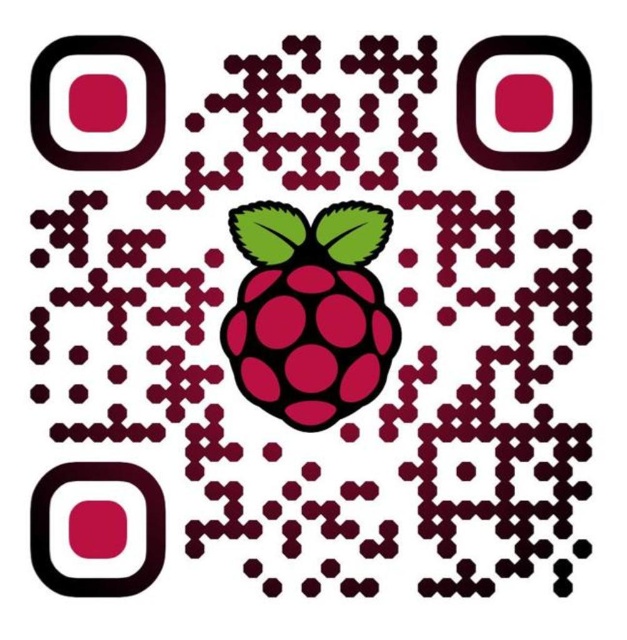
Question: Can you confirm if matte black square at bottom left is positioned below matte black square at upper right?

Choices:
 (A) no
 (B) yes

Answer: (B)

Question: Can you confirm if matte red raspberry at center is positioned to the left of matte black square at bottom left?

Choices:
 (A) yes
 (B) no

Answer: (B)

Question: Among these objects, which one is nearest to the camera?

Choices:
 (A) matte black square at upper left
 (B) matte black square at upper right
 (C) matte black square at bottom left

Answer: (C)

Question: Can you confirm if matte red raspberry at center is bigger than matte black square at upper right?

Choices:
 (A) no
 (B) yes

Answer: (B)

Question: Based on their relative distances, which object is farther from the matte black square at bottom left?

Choices:
 (A) matte black square at upper right
 (B) matte red raspberry at center

Answer: (A)

Question: Which point is closer to the camera taking this photo?

Choices:
 (A) (270, 285)
 (B) (140, 586)

Answer: (A)